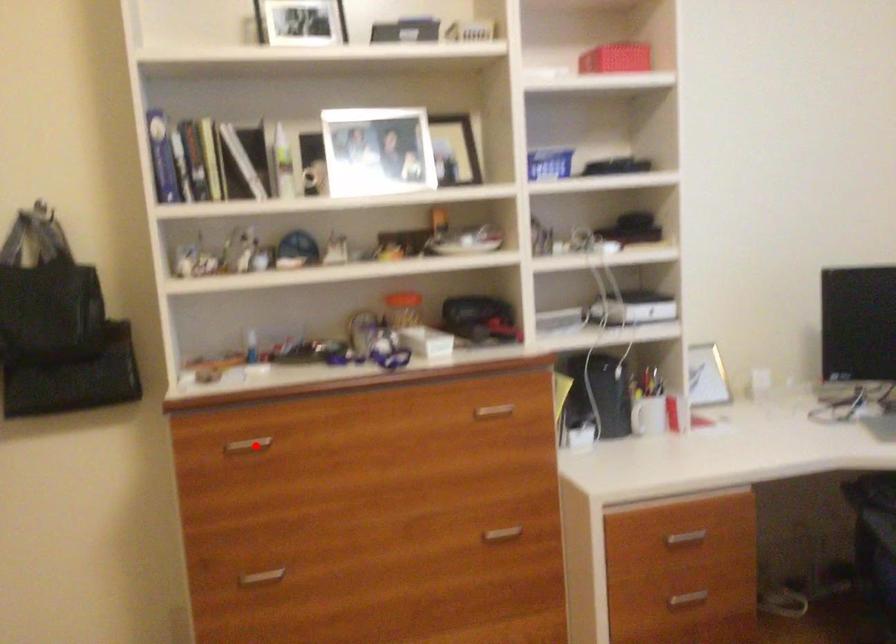
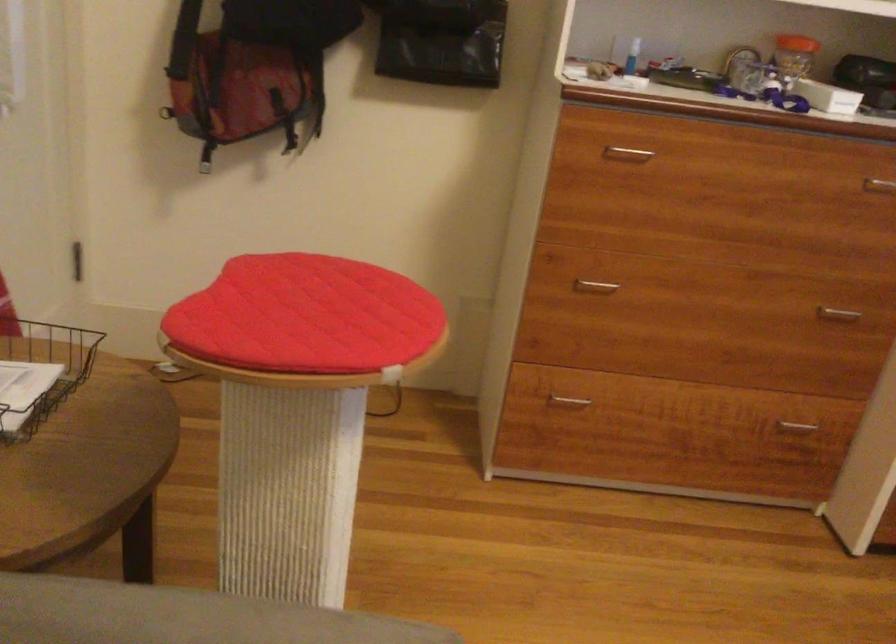
Question: I am providing you with two images of the same scene from different viewpoints. A red point is marked on the first image. At the location where the point appears in image 1, is it still visible in image 2?

Choices:
 (A) Yes
 (B) No

Answer: (A)